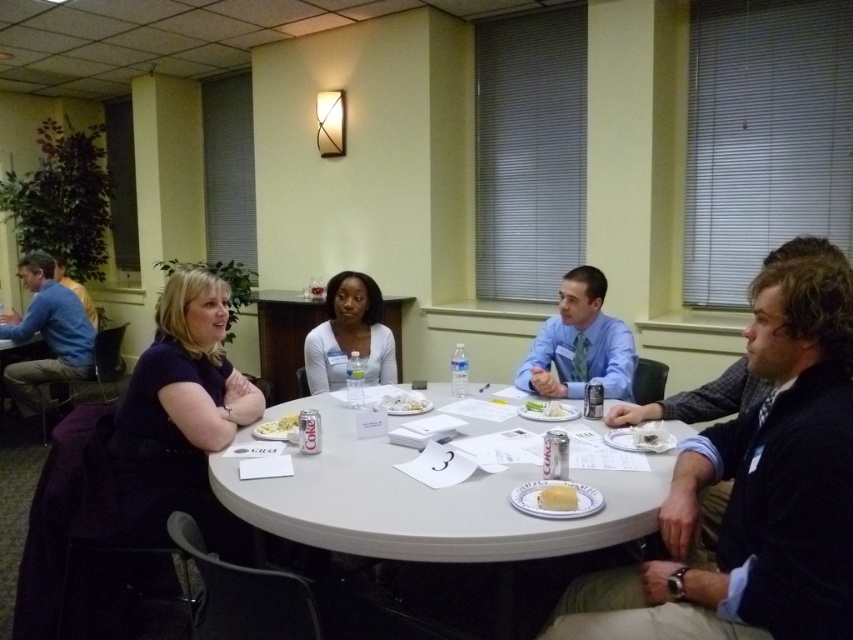
Is white plastic table at center smaller than white paper napkin at center?

Incorrect, white plastic table at center is not smaller in size than white paper napkin at center.

In order to click on white plastic table at center in this screenshot , I will do `click(425, 502)`.

Who is positioned more to the right, white paper napkin at center or white paper plate at center?

white paper napkin at center

In the scene shown: Is white paper napkin at center to the right of white paper plate at center from the viewer's perspective?

Correct, you'll find white paper napkin at center to the right of white paper plate at center.

Identify the location of white paper napkin at center. (405, 403).

The height and width of the screenshot is (640, 853). Identify the location of white paper napkin at center. (405, 403).

How much distance is there between smooth white shirt at center and white paper napkin at center?

The distance of smooth white shirt at center from white paper napkin at center is 21.72 inches.

Can you confirm if smooth white shirt at center is shorter than white paper napkin at center?

Incorrect, smooth white shirt at center's height does not fall short of white paper napkin at center's.

Is point (370, 336) farther from viewer compared to point (392, 403)?

Yes, point (370, 336) is farther from viewer.

Identify the location of smooth white shirt at center. This screenshot has width=853, height=640. (x=349, y=336).